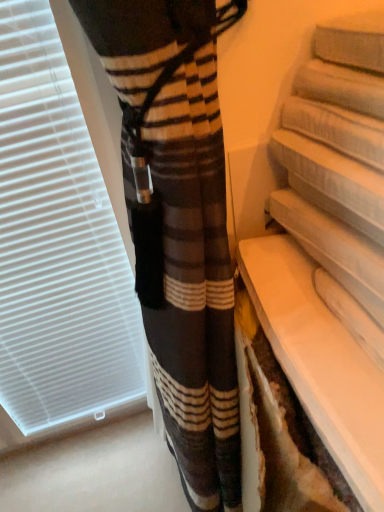
Question: Should I look upward or downward to see white glossy shelf at lower right?

Choices:
 (A) up
 (B) down

Answer: (B)

Question: Does white plastic window blind at left have a greater width compared to white glossy shelf at lower right?

Choices:
 (A) yes
 (B) no

Answer: (B)

Question: From a real-world perspective, is white plastic window blind at left positioned under white glossy shelf at lower right based on gravity?

Choices:
 (A) no
 (B) yes

Answer: (B)

Question: From the image's perspective, is white plastic window blind at left on top of white glossy shelf at lower right?

Choices:
 (A) no
 (B) yes

Answer: (B)

Question: Can you confirm if white plastic window blind at left is positioned to the right of white glossy shelf at lower right?

Choices:
 (A) yes
 (B) no

Answer: (B)

Question: Can you confirm if white plastic window blind at left is positioned to the left of white glossy shelf at lower right?

Choices:
 (A) no
 (B) yes

Answer: (B)

Question: From the image's perspective, does white plastic window blind at left appear lower than white glossy shelf at lower right?

Choices:
 (A) yes
 (B) no

Answer: (B)

Question: Considering the relative sizes of white glossy shelf at lower right and white plastic window blind at left in the image provided, is white glossy shelf at lower right smaller than white plastic window blind at left?

Choices:
 (A) no
 (B) yes

Answer: (B)

Question: Is white glossy shelf at lower right surrounding white plastic window blind at left?

Choices:
 (A) no
 (B) yes

Answer: (A)

Question: Is white glossy shelf at lower right facing away from white plastic window blind at left?

Choices:
 (A) no
 (B) yes

Answer: (A)

Question: From the image's perspective, is white glossy shelf at lower right under white plastic window blind at left?

Choices:
 (A) no
 (B) yes

Answer: (B)

Question: From the image's perspective, does white glossy shelf at lower right appear higher than white plastic window blind at left?

Choices:
 (A) yes
 (B) no

Answer: (B)

Question: Is white glossy shelf at lower right further to the viewer compared to white plastic window blind at left?

Choices:
 (A) no
 (B) yes

Answer: (A)

Question: Looking at their shapes, would you say white plastic window blind at left is wider or thinner than white glossy shelf at lower right?

Choices:
 (A) wide
 (B) thin

Answer: (B)